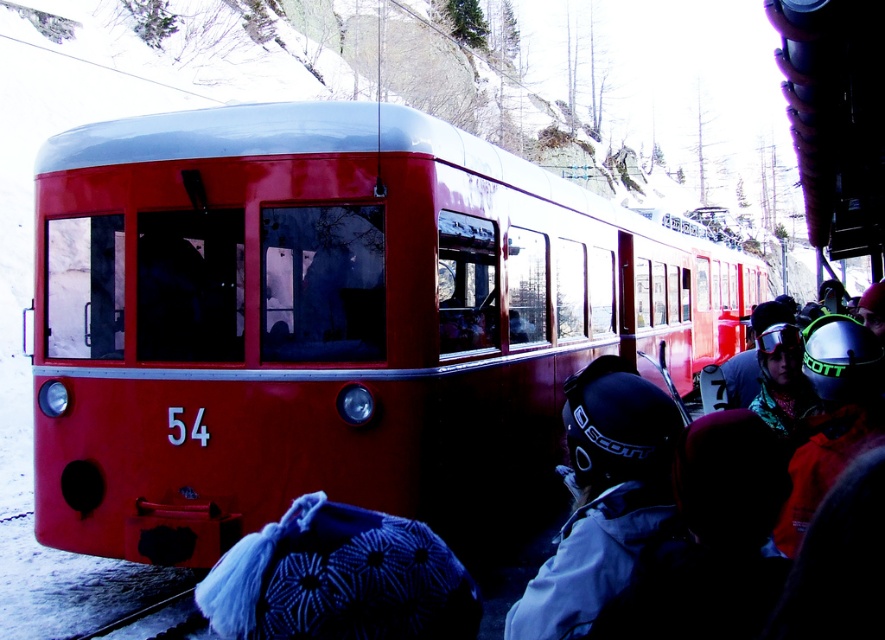
Question: Can you confirm if shiny red train at center is smaller than matte black helmet at center?

Choices:
 (A) yes
 (B) no

Answer: (B)

Question: Among these points, which one is nearest to the camera?

Choices:
 (A) (198, 538)
 (B) (606, 390)

Answer: (B)

Question: Can you confirm if shiny red train at center is positioned to the left of matte black helmet at center?

Choices:
 (A) no
 (B) yes

Answer: (A)

Question: Which object is farther from the camera taking this photo?

Choices:
 (A) shiny red train at center
 (B) matte black helmet at center

Answer: (A)

Question: Is shiny red train at center behind matte black helmet at center?

Choices:
 (A) no
 (B) yes

Answer: (B)